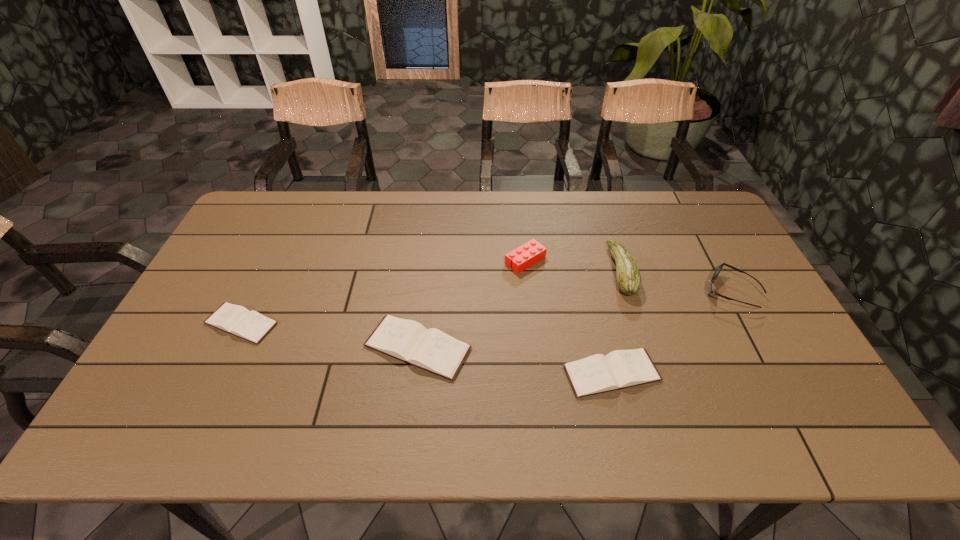
Image resolution: width=960 pixels, height=540 pixels. Identify the location of free space that satisfies the following two spatial constraints: 1. on the front side of the second diary from right to left; 2. on the left side of the shortest diary. (230, 347).

Where is `blank space that satisfies the following two spatial constraints: 1. at the stem end of the tallest object; 2. on the front side of the fifth tallest object`? Image resolution: width=960 pixels, height=540 pixels. blank space that satisfies the following two spatial constraints: 1. at the stem end of the tallest object; 2. on the front side of the fifth tallest object is located at coordinates (653, 373).

The width and height of the screenshot is (960, 540). In order to click on free spot that satisfies the following two spatial constraints: 1. on the front side of the second diary from right to left; 2. on the right side of the rightmost diary in this screenshot , I will do `click(415, 373)`.